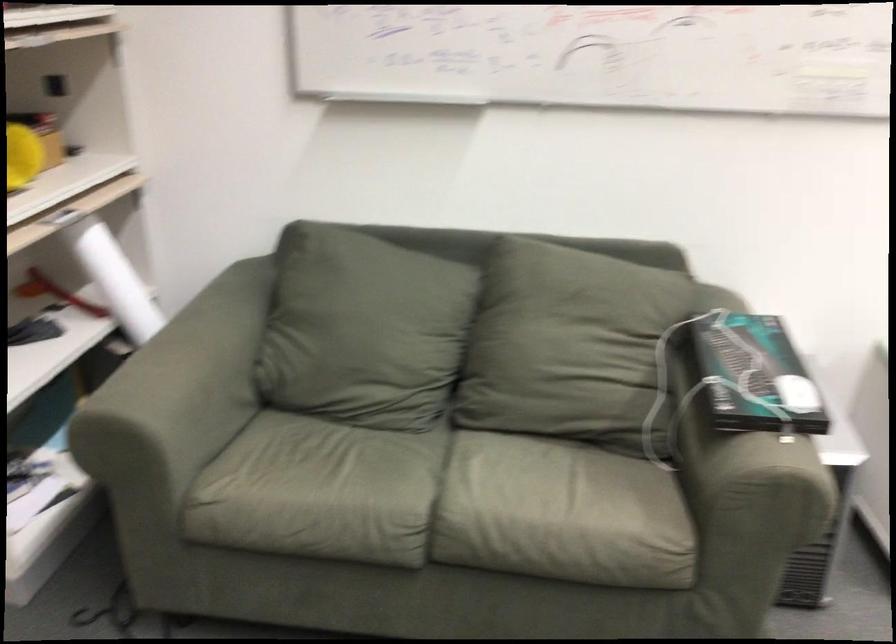
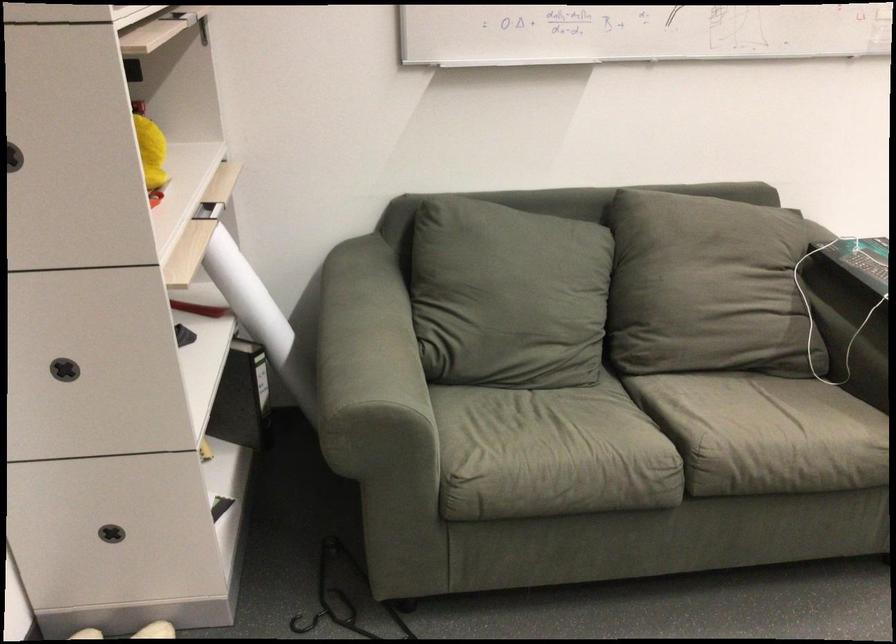
Question: I am providing you with two images of the same scene from different viewpoints. After the viewpoint changes to image2, which objects are now occluded?

Choices:
 (A) white paper roll
 (B) sofa armrest
 (C) black metal hook
 (D) none of these

Answer: (D)